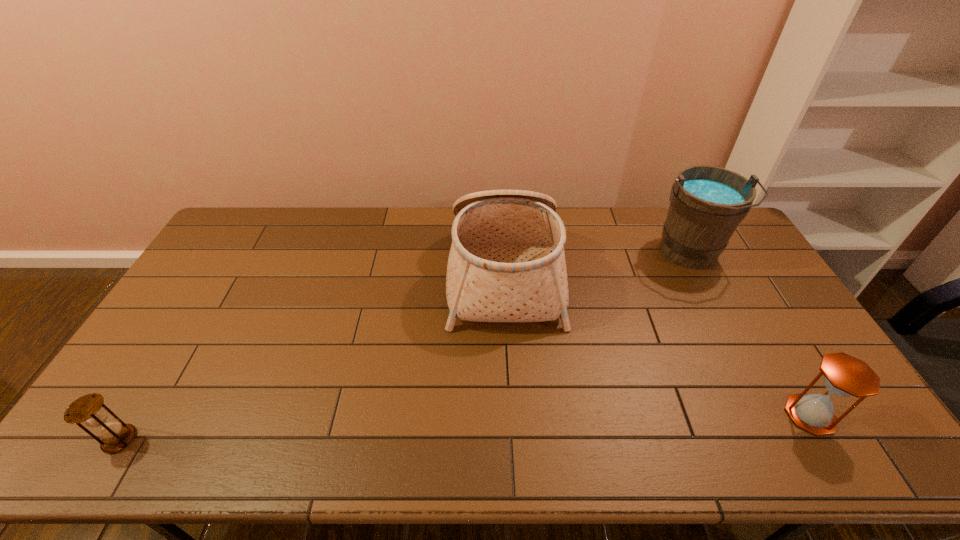
The image size is (960, 540). In order to click on free space at the far edge of the desktop in this screenshot , I will do `click(603, 232)`.

Locate an element on the screen. The height and width of the screenshot is (540, 960). blank space at the left edge of the desktop is located at coordinates (215, 259).

Find the location of a particular element. free space at the right edge of the desktop is located at coordinates (793, 358).

Where is `vacant space at the far left corner of the desktop`? vacant space at the far left corner of the desktop is located at coordinates (250, 211).

Find the location of a particular element. The image size is (960, 540). vacant space that's between the leftmost object and the third tallest object is located at coordinates (465, 427).

Find the location of a particular element. The width and height of the screenshot is (960, 540). free space between the basket and the taller hourglass is located at coordinates (657, 343).

Where is `empty space that is in between the shortest object and the right hourglass`? The width and height of the screenshot is (960, 540). empty space that is in between the shortest object and the right hourglass is located at coordinates (465, 427).

Where is `unoccupied area between the basket and the wine bucket`? unoccupied area between the basket and the wine bucket is located at coordinates (597, 264).

Identify the location of empty location between the basket and the taller hourglass. This screenshot has width=960, height=540. (657, 343).

Where is `empty space that is in between the wine bucket and the shorter hourglass`? The height and width of the screenshot is (540, 960). empty space that is in between the wine bucket and the shorter hourglass is located at coordinates (404, 347).